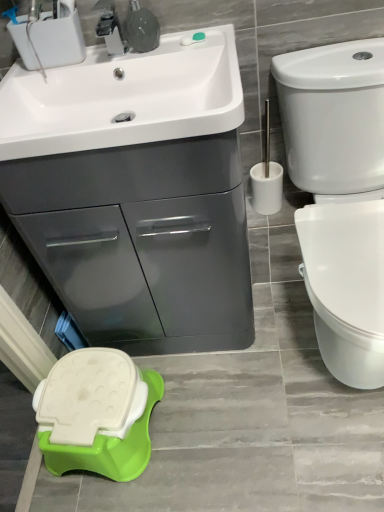
At what (x,y) coordinates should I click in order to perform the action: click on matte gray cabinet at upper left. Please return your answer as a coordinate pair (x, y). Looking at the image, I should click on (142, 241).

From the image's perspective, who appears lower, green plastic stool at lower left or white glossy sink at upper left?

From the image's view, green plastic stool at lower left is below.

Is green plastic stool at lower left to the left or to the right of white glossy sink at upper left in the image?

In the image, green plastic stool at lower left appears on the left side of white glossy sink at upper left.

Is green plastic stool at lower left not inside white glossy sink at upper left?

That's correct, green plastic stool at lower left is outside of white glossy sink at upper left.

From a real-world perspective, is green plastic stool at lower left physically above brushed metal faucet at upper center?

Actually, green plastic stool at lower left is physically below brushed metal faucet at upper center in the real world.

Does green plastic stool at lower left appear on the left side of brushed metal faucet at upper center?

Indeed, green plastic stool at lower left is positioned on the left side of brushed metal faucet at upper center.

Considering the positions of objects green plastic stool at lower left and brushed metal faucet at upper center in the image provided, who is in front, green plastic stool at lower left or brushed metal faucet at upper center?

brushed metal faucet at upper center is in front.

Considering the sizes of objects green plastic stool at lower left and brushed metal faucet at upper center in the image provided, who is taller, green plastic stool at lower left or brushed metal faucet at upper center?

green plastic stool at lower left.

From the image's perspective, is green plastic stool at lower left below white plastic toilet brush at right?

Indeed, from the image's perspective, green plastic stool at lower left is shown beneath white plastic toilet brush at right.

Identify the location of brush above the green plastic stool at lower left (from the image's perspective). (267, 178).

Could you tell me if green plastic stool at lower left is turned towards white plastic toilet brush at right?

No, green plastic stool at lower left is not oriented towards white plastic toilet brush at right.

Who is shorter, green plastic stool at lower left or white plastic toilet brush at right?

With less height is green plastic stool at lower left.

Is white glossy sink at upper left oriented towards white plastic toilet brush at right?

No, white glossy sink at upper left is not facing towards white plastic toilet brush at right.

From a real-world perspective, is white glossy sink at upper left over white plastic toilet brush at right?

Yes, from a real-world perspective, white glossy sink at upper left is on top of white plastic toilet brush at right.

Is the depth of white glossy sink at upper left greater than that of white plastic toilet brush at right?

No, white glossy sink at upper left is closer to the viewer.

From the image's perspective, which one is positioned lower, white glossy sink at upper left or white plastic toilet brush at right?

From the image's view, white plastic toilet brush at right is below.

In terms of height, does white glossy sink at upper left look taller or shorter compared to green plastic stool at lower left?

white glossy sink at upper left is shorter than green plastic stool at lower left.

Can you tell me how much white glossy sink at upper left and green plastic stool at lower left differ in facing direction?

The angular difference between white glossy sink at upper left and green plastic stool at lower left is 4.22 degrees.

In terms of width, does white glossy sink at upper left look wider or thinner when compared to green plastic stool at lower left?

Clearly, white glossy sink at upper left has more width compared to green plastic stool at lower left.

Based on the photo, from the image's perspective, which one is positioned lower, white glossy sink at upper left or green plastic stool at lower left?

green plastic stool at lower left.

Which object is more forward, brushed metal faucet at upper center or white plastic toilet brush at right?

brushed metal faucet at upper center.

Are brushed metal faucet at upper center and white plastic toilet brush at right beside each other?

They are not placed beside each other.

From a real-world perspective, which is physically below, brushed metal faucet at upper center or white plastic toilet brush at right?

From a 3D spatial view, white plastic toilet brush at right is below.

Can you confirm if brushed metal faucet at upper center is thinner than white plastic toilet brush at right?

Yes, brushed metal faucet at upper center is thinner than white plastic toilet brush at right.

Considering their positions, is white plastic toilet brush at right located in front of or behind green plastic stool at lower left?

Clearly, white plastic toilet brush at right is behind green plastic stool at lower left.

Consider the image. From a real-world perspective, is white plastic toilet brush at right above or below green plastic stool at lower left?

In terms of real-world spatial position, white plastic toilet brush at right is above green plastic stool at lower left.

Would you consider white plastic toilet brush at right to be distant from green plastic stool at lower left?

Actually, white plastic toilet brush at right and green plastic stool at lower left are a little close together.

Considering the positions of point (279, 183) and point (77, 362), is point (279, 183) closer or farther from the camera than point (77, 362)?

Point (279, 183) is farther from the camera than point (77, 362).

At what (x,y) coordinates should I click in order to perform the action: click on porcelain lying on the left of white glossy sink at upper left. Please return your answer as a coordinate pair (x, y). This screenshot has height=512, width=384. Looking at the image, I should click on (97, 414).

At what (x,y) coordinates should I click in order to perform the action: click on porcelain located below the brushed metal faucet at upper center (from the image's perspective). Please return your answer as a coordinate pair (x, y). The height and width of the screenshot is (512, 384). Looking at the image, I should click on (97, 414).

When comparing their distances from white plastic toilet brush at right, does matte gray cabinet at upper left or white glossy toilet at right seem further?

Based on the image, matte gray cabinet at upper left appears to be further to white plastic toilet brush at right.

Based on their spatial positions, is brushed metal faucet at upper center or green plastic stool at lower left further from white glossy toilet at right?

The object further to white glossy toilet at right is green plastic stool at lower left.

From the image, which object appears to be nearer to white glossy sink at upper left, brushed metal faucet at upper center or matte gray cabinet at upper left?

brushed metal faucet at upper center is positioned closer to the anchor white glossy sink at upper left.

Based on the photo, which object lies further to the anchor point white glossy sink at upper left, white plastic toilet brush at right or matte gray cabinet at upper left?

white plastic toilet brush at right is further to white glossy sink at upper left.

Based on their spatial positions, is white glossy toilet at right or matte gray cabinet at upper left further from white plastic toilet brush at right?

Based on the image, matte gray cabinet at upper left appears to be further to white plastic toilet brush at right.

Which object lies further to the anchor point white glossy toilet at right, white glossy sink at upper left or matte gray cabinet at upper left?

white glossy sink at upper left is positioned further to the anchor white glossy toilet at right.

Estimate the real-world distances between objects in this image. Which object is further from white glossy toilet at right, white glossy sink at upper left or green plastic stool at lower left?

green plastic stool at lower left is further to white glossy toilet at right.

Estimate the real-world distances between objects in this image. Which object is closer to white plastic toilet brush at right, matte gray cabinet at upper left or brushed metal faucet at upper center?

matte gray cabinet at upper left lies closer to white plastic toilet brush at right than the other object.

The height and width of the screenshot is (512, 384). I want to click on brush between white glossy sink at upper left and white glossy toilet at right in the horizontal direction, so click(x=267, y=178).

Where is `brush between brushed metal faucet at upper center and matte gray cabinet at upper left in the vertical direction`? Image resolution: width=384 pixels, height=512 pixels. brush between brushed metal faucet at upper center and matte gray cabinet at upper left in the vertical direction is located at coordinates (267, 178).

Identify the location of brush located between brushed metal faucet at upper center and white glossy toilet at right in the left-right direction. (267, 178).

You are a GUI agent. You are given a task and a screenshot of the screen. Output one action in this format:
    pyautogui.click(x=<x>, y=<y>)
    Task: Click on the sink between brushed metal faucet at upper center and green plastic stool at lower left in the vertical direction
    The image size is (384, 512).
    Given the screenshot: What is the action you would take?
    pyautogui.click(x=124, y=97)